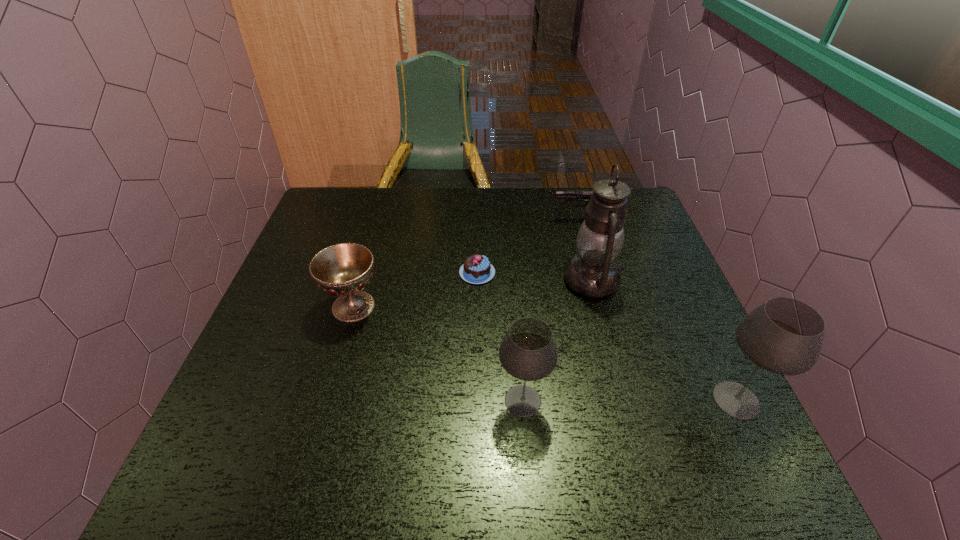
Locate an element on the screen. This screenshot has width=960, height=540. vacant position at the near right corner of the desktop is located at coordinates (667, 411).

Locate an element on the screen. The height and width of the screenshot is (540, 960). vacant space in between the tallest object and the right wineglass is located at coordinates (664, 340).

Where is `unoccupied position between the tallest object and the right wineglass`? unoccupied position between the tallest object and the right wineglass is located at coordinates (664, 340).

Where is `empty location between the third tallest object and the chalice`? empty location between the third tallest object and the chalice is located at coordinates (438, 354).

The height and width of the screenshot is (540, 960). I want to click on unoccupied position between the tallest object and the leftmost object, so click(x=472, y=293).

Image resolution: width=960 pixels, height=540 pixels. What are the coordinates of `blank region between the chocolate cake and the chalice` in the screenshot? It's located at (416, 289).

In order to click on free spot between the pistol and the chocolate cake in this screenshot , I will do `click(526, 246)`.

Image resolution: width=960 pixels, height=540 pixels. I want to click on free point between the fourth shortest object and the shortest object, so click(x=500, y=337).

Find the location of `free area in between the rightmost object and the pistol`. free area in between the rightmost object and the pistol is located at coordinates (656, 309).

Locate an element on the screen. This screenshot has width=960, height=540. empty space between the shorter wineglass and the fifth tallest object is located at coordinates (549, 310).